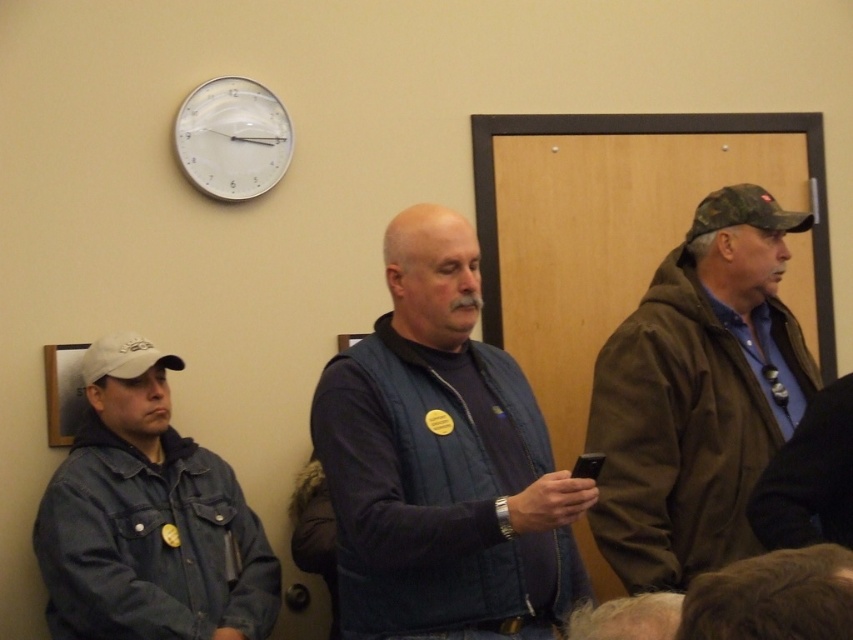
Where is the denim jacket at left located in the image?

The denim jacket at left is located at point (148,518) in the image.

You are standing in the room and want to check the time on the white plastic clock at upper center without moving closer. Can you see the black plastic phone at center in your line of sight when looking at the clock?

Yes, because the white plastic clock at upper center is further away from you than the black plastic phone at center, so when looking at the clock, the phone would be in your line of sight between you and the clock.

You are a tailor measuring the blue denim vest at center and the black plastic phone at center. Which item has a greater width?

The blue denim vest at center has a greater width than the black plastic phone at center.